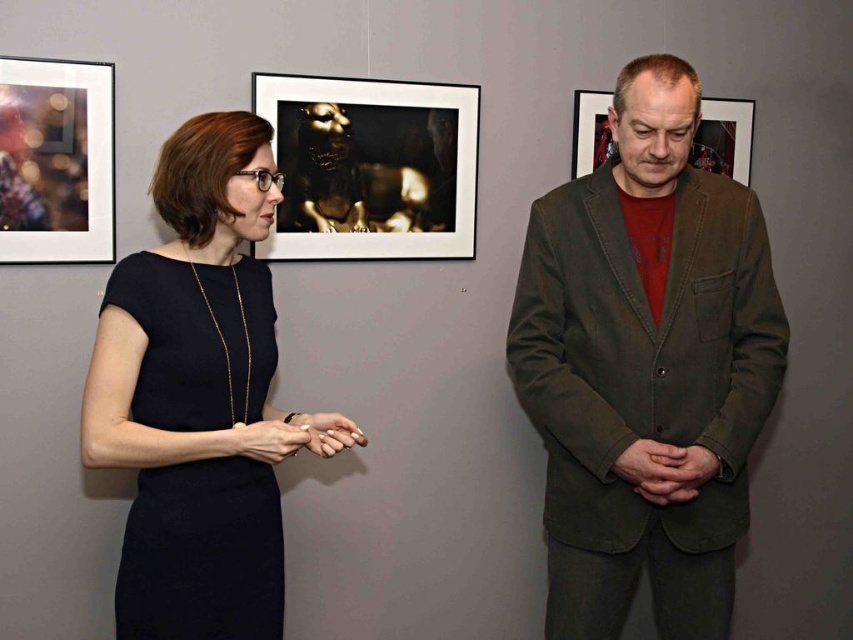
Which is below, metallic glass frame at upper left or matte brown frame at center?

metallic glass frame at upper left is below.

Is metallic glass frame at upper left shorter than matte brown frame at center?

No.

Find the location of `metallic glass frame at upper left`. metallic glass frame at upper left is located at coordinates (55, 161).

The width and height of the screenshot is (853, 640). In order to click on metallic glass frame at upper left in this screenshot , I will do `click(55, 161)`.

Who is more distant from viewer, (554, 500) or (265, 448)?

The point (554, 500) is behind.

Does dark olive corduroy blazer at center appear over matte black hand at center?

Correct, dark olive corduroy blazer at center is located above matte black hand at center.

Who is more distant from viewer, (585, 608) or (270, 428)?

The point (585, 608) is behind.

Find the location of `dark olive corduroy blazer at center`. dark olive corduroy blazer at center is located at coordinates (646, 368).

Is black matte dress at left positioned at the back of matte brown frame at center?

No, it is not.

Identify the location of black matte dress at left. This screenshot has width=853, height=640. (196, 396).